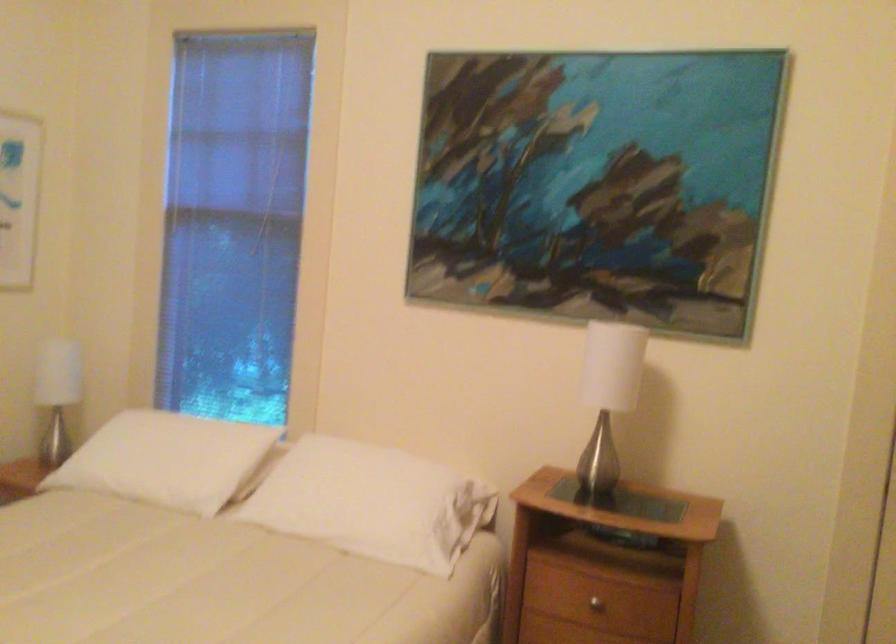
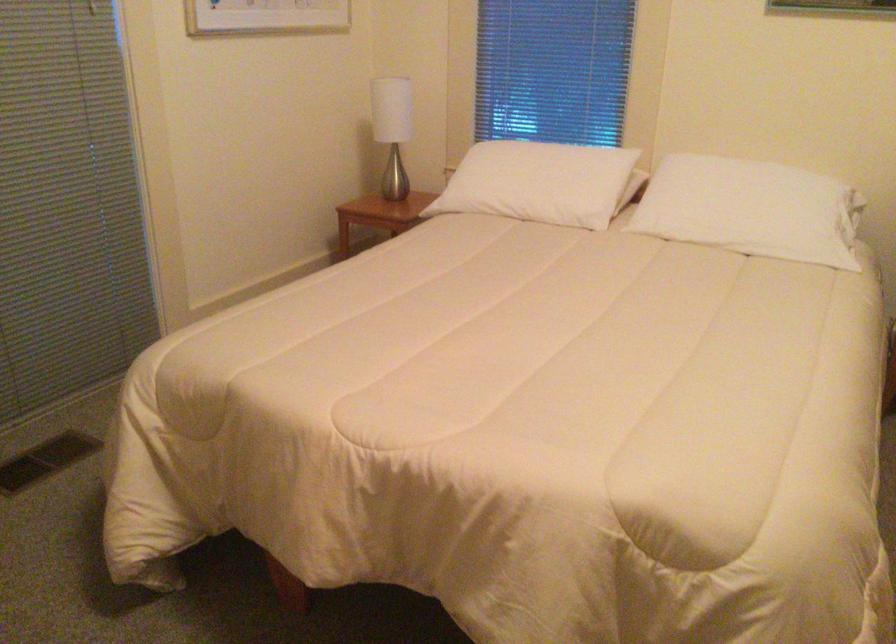
Locate, in the second image, the point that corresponds to [159,462] in the first image.

(538, 183)